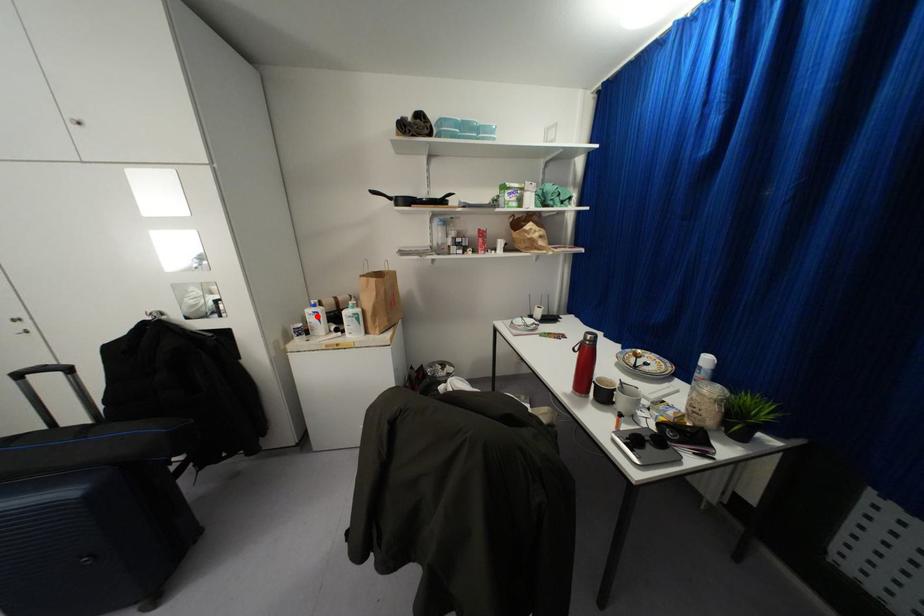
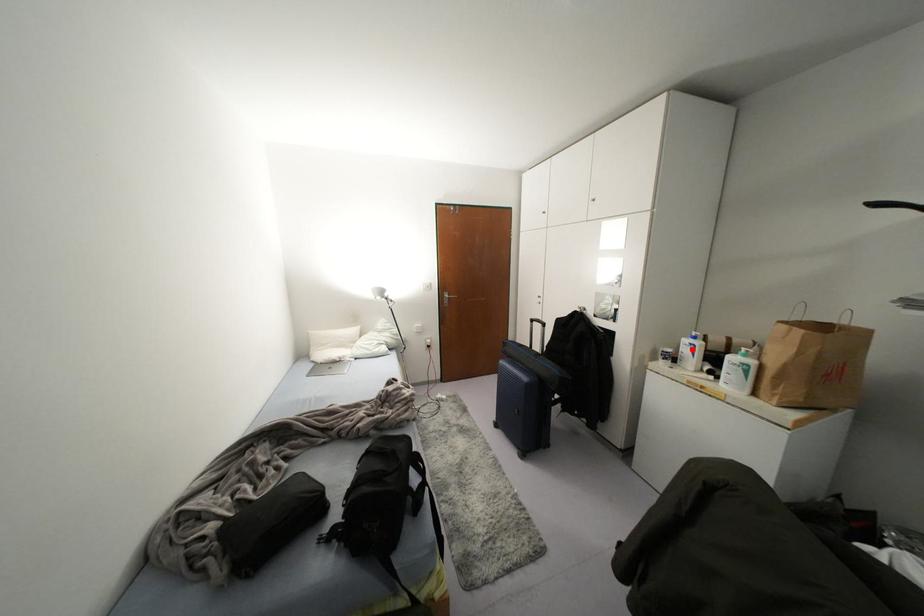
I am providing you with two images of the same scene from different viewpoints. A red point is marked on the first image and another point is marked on the second image. Is the marked point in image1 the same physical position as the marked point in image2?

Yes